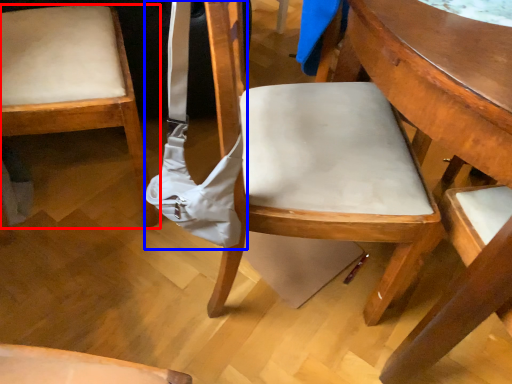
Question: Which object appears closest to the camera in this image, chair (highlighted by a red box) or shoulder bag (highlighted by a blue box)?

Choices:
 (A) chair
 (B) shoulder bag

Answer: (B)